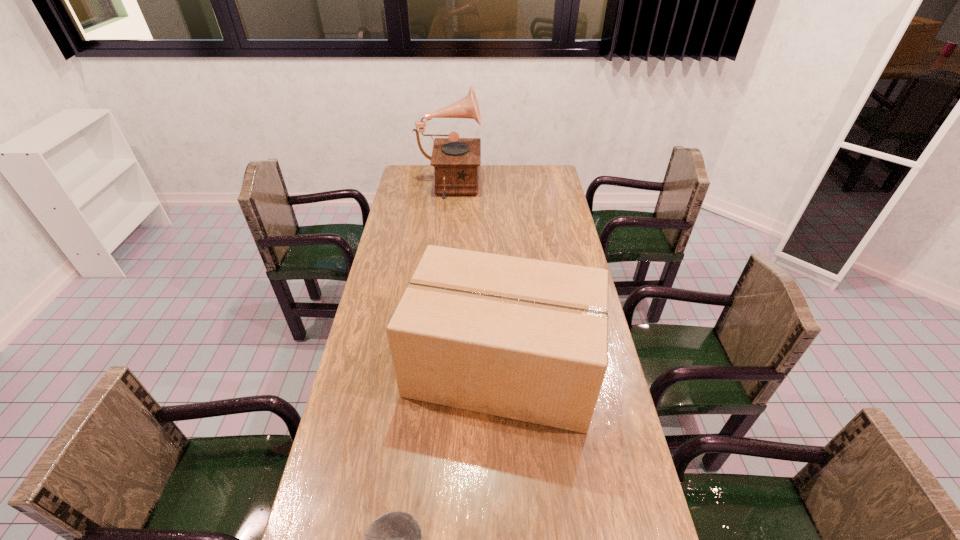
Find the location of a particular element. Image resolution: width=960 pixels, height=540 pixels. record player is located at coordinates (456, 160).

You are a GUI agent. You are given a task and a screenshot of the screen. Output one action in this format:
    pyautogui.click(x=<x>, y=<y>)
    Task: Click on the farthest object
    This screenshot has width=960, height=540.
    Given the screenshot: What is the action you would take?
    pyautogui.click(x=456, y=160)

Identify the location of the second farthest object. The height and width of the screenshot is (540, 960). (525, 339).

The image size is (960, 540). Find the location of `the second tallest object`. the second tallest object is located at coordinates (525, 339).

Where is `vacant region located on the horn of the record player`? vacant region located on the horn of the record player is located at coordinates (498, 190).

The width and height of the screenshot is (960, 540). In order to click on vacant space located 0.210m on the back of the second shortest object in this screenshot , I will do `click(497, 273)`.

What are the coordinates of `object situated at the far edge` in the screenshot? It's located at (456, 160).

Where is `record player that is at the left edge`? This screenshot has width=960, height=540. record player that is at the left edge is located at coordinates click(x=456, y=160).

Locate an element on the screen. This screenshot has width=960, height=540. box present at the left edge is located at coordinates (525, 339).

You are a GUI agent. You are given a task and a screenshot of the screen. Output one action in this format:
    pyautogui.click(x=<x>, y=<y>)
    Task: Click on the object that is at the right edge
    
    Given the screenshot: What is the action you would take?
    click(525, 339)